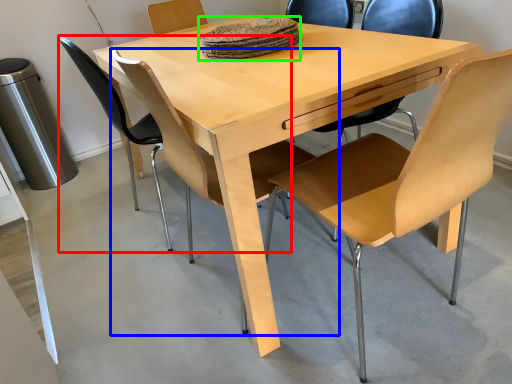
Question: Which object is positioned closest to chair (highlighted by a red box)? Select from chair (highlighted by a blue box) and food (highlighted by a green box).

Choices:
 (A) chair
 (B) food

Answer: (A)